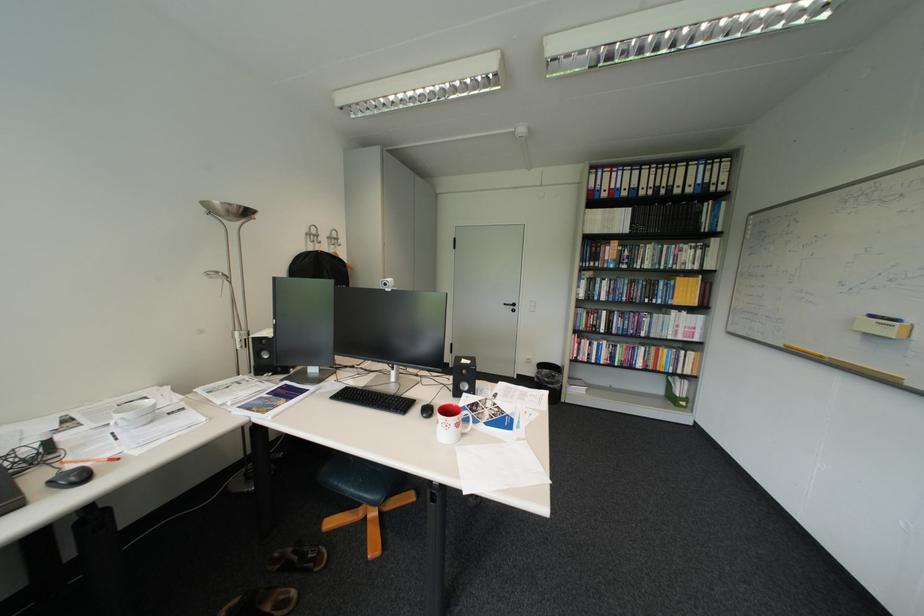
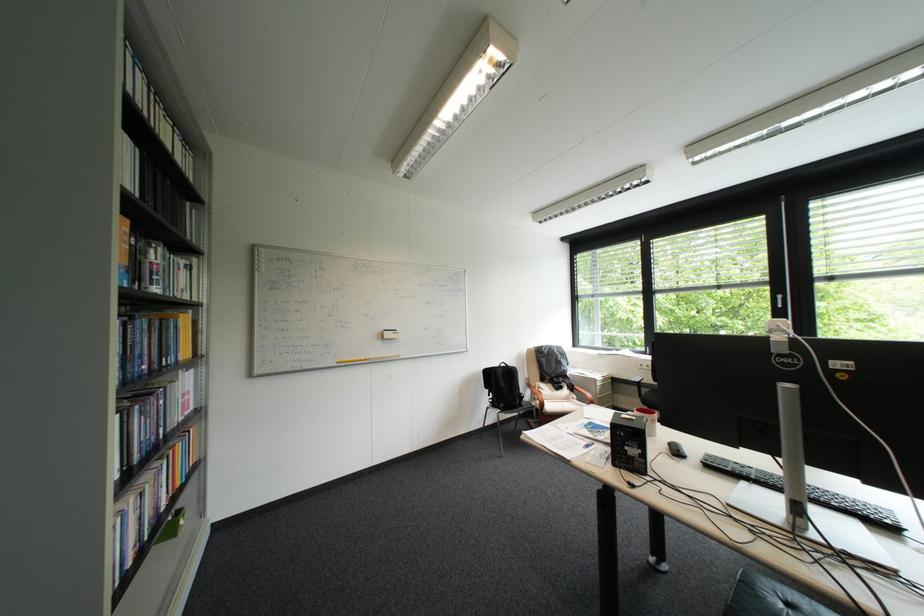
Locate, in the second image, the point that corresponds to (x=799, y=344) in the first image.

(350, 361)